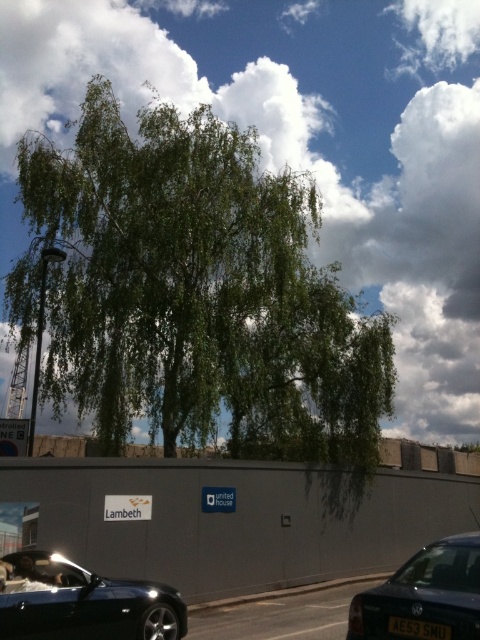
Question: Which of the following is the farthest from the observer?

Choices:
 (A) (137, 141)
 (B) (399, 602)

Answer: (A)

Question: Can you confirm if green leafy tree at center is positioned above matte black car at lower right?

Choices:
 (A) no
 (B) yes

Answer: (B)

Question: Can you confirm if matte black car at lower right is bigger than black plastic license plate at center?

Choices:
 (A) yes
 (B) no

Answer: (A)

Question: Which object is farther from the camera taking this photo?

Choices:
 (A) green leafy tree at center
 (B) matte black car at lower right

Answer: (A)

Question: From the image, what is the correct spatial relationship of green leafy tree at center in relation to black plastic license plate at center?

Choices:
 (A) left
 (B) right

Answer: (A)

Question: Which object is the closest to the green leafy tree at center?

Choices:
 (A) shiny black car at lower left
 (B) matte black car at lower right

Answer: (A)